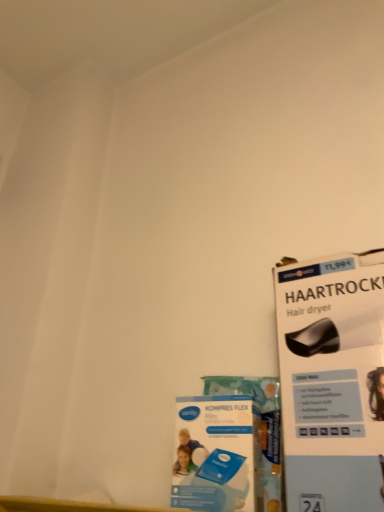
Measure the distance between point (246, 500) and camera.

Point (246, 500) is 17.76 inches away from camera.

What are the coordinates of `blue cardboard flyer at lower center` in the screenshot? It's located at (217, 454).

What do you see at coordinates (217, 454) in the screenshot? The image size is (384, 512). I see `blue cardboard flyer at lower center` at bounding box center [217, 454].

Find the location of a particular element. This screenshot has width=384, height=512. white cardboard hair dryer at upper right is located at coordinates (332, 381).

Describe the element at coordinates (332, 381) in the screenshot. The image size is (384, 512). I see `white cardboard hair dryer at upper right` at that location.

Image resolution: width=384 pixels, height=512 pixels. In order to click on blue cardboard flyer at lower center in this screenshot , I will do `click(217, 454)`.

From the picture: Which is more to the right, white cardboard hair dryer at upper right or blue cardboard flyer at lower center?

From the viewer's perspective, white cardboard hair dryer at upper right appears more on the right side.

Is the depth of white cardboard hair dryer at upper right greater than that of blue cardboard flyer at lower center?

No.

Which is closer to the camera, (x=369, y=267) or (x=187, y=507)?

The point (x=187, y=507) is more forward.

From the image's perspective, is white cardboard hair dryer at upper right on top of blue cardboard flyer at lower center?

Yes, from the image's perspective, white cardboard hair dryer at upper right is on top of blue cardboard flyer at lower center.

From a real-world perspective, between white cardboard hair dryer at upper right and blue cardboard flyer at lower center, who is vertically lower?

blue cardboard flyer at lower center is physically lower.

Consider the image. Looking at their sizes, would you say white cardboard hair dryer at upper right is wider or thinner than blue cardboard flyer at lower center?

In the image, white cardboard hair dryer at upper right appears to be wider than blue cardboard flyer at lower center.

From the picture: Is white cardboard hair dryer at upper right taller or shorter than blue cardboard flyer at lower center?

In the image, white cardboard hair dryer at upper right appears to be taller than blue cardboard flyer at lower center.

Is white cardboard hair dryer at upper right bigger or smaller than blue cardboard flyer at lower center?

white cardboard hair dryer at upper right is bigger than blue cardboard flyer at lower center.

Do you think white cardboard hair dryer at upper right is within blue cardboard flyer at lower center, or outside of it?

white cardboard hair dryer at upper right is not inside blue cardboard flyer at lower center, it's outside.

Is white cardboard hair dryer at upper right with blue cardboard flyer at lower center?

No, white cardboard hair dryer at upper right is not touching blue cardboard flyer at lower center.

Could you tell me if white cardboard hair dryer at upper right is turned towards blue cardboard flyer at lower center?

No, white cardboard hair dryer at upper right does not turn towards blue cardboard flyer at lower center.

This screenshot has height=512, width=384. In order to click on magazine located above the blue cardboard flyer at lower center (from a real-world perspective) in this screenshot , I will do `click(332, 381)`.

From the picture: Between blue cardboard flyer at lower center and white cardboard hair dryer at upper right, which one appears on the left side from the viewer's perspective?

From the viewer's perspective, blue cardboard flyer at lower center appears more on the left side.

Consider the image. Is the position of blue cardboard flyer at lower center more distant than that of white cardboard hair dryer at upper right?

Yes.

Is point (176, 426) closer to camera compared to point (377, 333)?

No, it is not.

From the image's perspective, between blue cardboard flyer at lower center and white cardboard hair dryer at upper right, who is located below?

From the image's view, blue cardboard flyer at lower center is below.

From a real-world perspective, relative to white cardboard hair dryer at upper right, is blue cardboard flyer at lower center vertically above or below?

Clearly, from a real-world perspective, blue cardboard flyer at lower center is below white cardboard hair dryer at upper right.

Which object is thinner, blue cardboard flyer at lower center or white cardboard hair dryer at upper right?

With smaller width is blue cardboard flyer at lower center.

Does blue cardboard flyer at lower center have a lesser height compared to white cardboard hair dryer at upper right?

Correct, blue cardboard flyer at lower center is not as tall as white cardboard hair dryer at upper right.

Is blue cardboard flyer at lower center bigger than white cardboard hair dryer at upper right?

Actually, blue cardboard flyer at lower center might be smaller than white cardboard hair dryer at upper right.

Is blue cardboard flyer at lower center positioned beyond the bounds of white cardboard hair dryer at upper right?

Yes, blue cardboard flyer at lower center is outside of white cardboard hair dryer at upper right.

Would you consider blue cardboard flyer at lower center to be distant from white cardboard hair dryer at upper right?

Actually, blue cardboard flyer at lower center and white cardboard hair dryer at upper right are a little close together.

Is blue cardboard flyer at lower center aimed at white cardboard hair dryer at upper right?

No, blue cardboard flyer at lower center is not aimed at white cardboard hair dryer at upper right.

I want to click on magazine in front of the blue cardboard flyer at lower center, so click(x=332, y=381).

In order to click on magazine above the blue cardboard flyer at lower center (from a real-world perspective) in this screenshot , I will do `click(332, 381)`.

Locate an element on the screen. The image size is (384, 512). flyer on the left of white cardboard hair dryer at upper right is located at coordinates (217, 454).